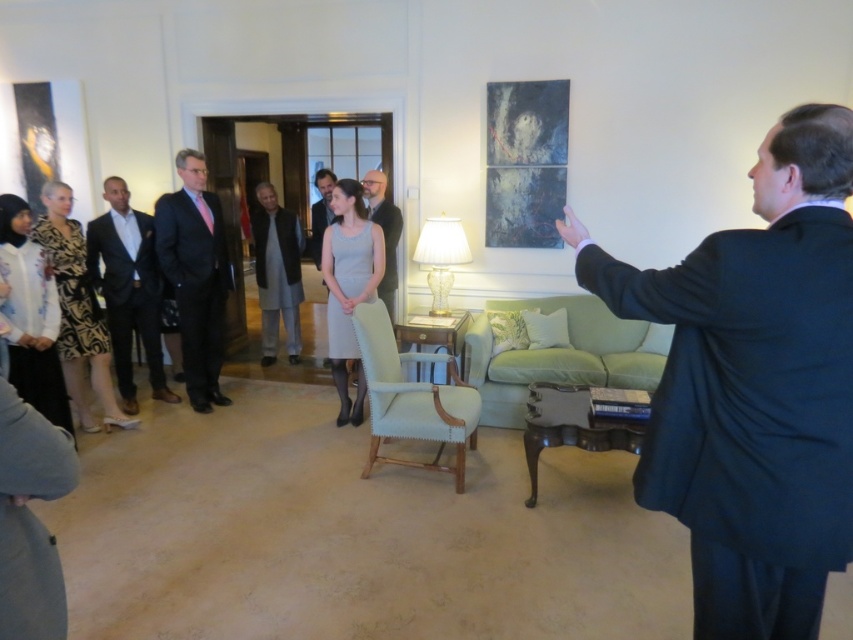
Question: Which of the following is the closest to the observer?

Choices:
 (A) printed fabric dress at left
 (B) white satin dress at lower left

Answer: (B)

Question: Does dark suit at left appear under dark gray wool business suit at center?

Choices:
 (A) no
 (B) yes

Answer: (B)

Question: Among these objects, which one is farthest from the camera?

Choices:
 (A) matte black suit at left
 (B) white satin dress at lower left
 (C) dark suit at left
 (D) dark gray wool business suit at lower left

Answer: (C)

Question: Can you confirm if black suit at upper right is positioned below white satin dress at lower left?

Choices:
 (A) yes
 (B) no

Answer: (A)

Question: Which of the following is the farthest from the observer?

Choices:
 (A) [x=200, y=260]
 (B) [x=44, y=424]
 (C) [x=788, y=355]
 (D) [x=380, y=195]

Answer: (D)

Question: Is printed fabric dress at left above light brown leather jacket at center?

Choices:
 (A) no
 (B) yes

Answer: (A)